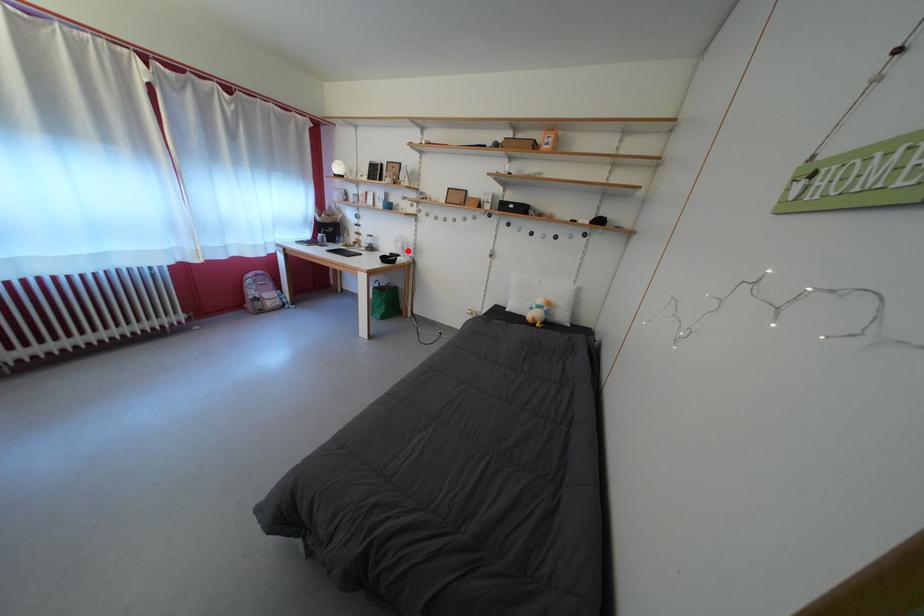
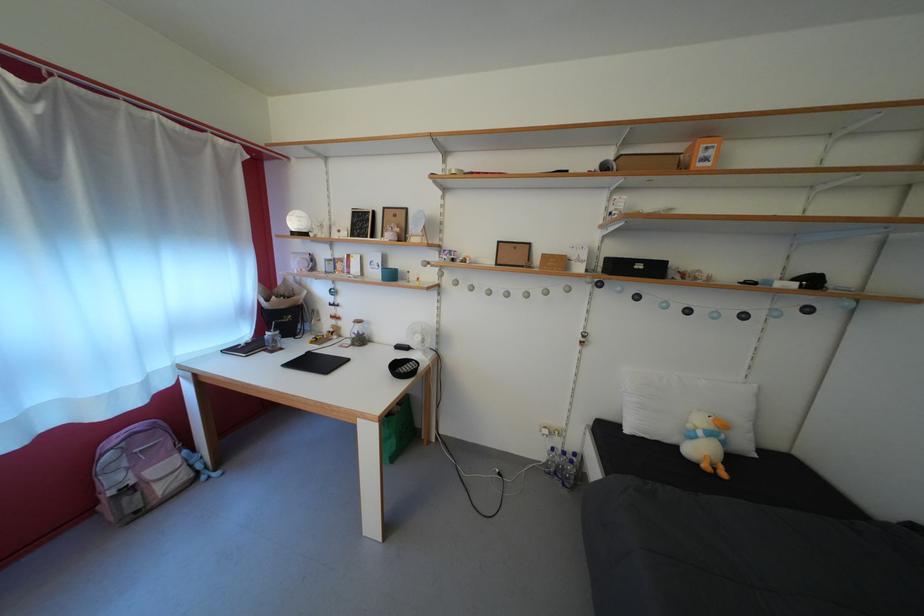
The point at the highlighted location is marked in the first image. Where is the corresponding point in the second image?

(427, 344)